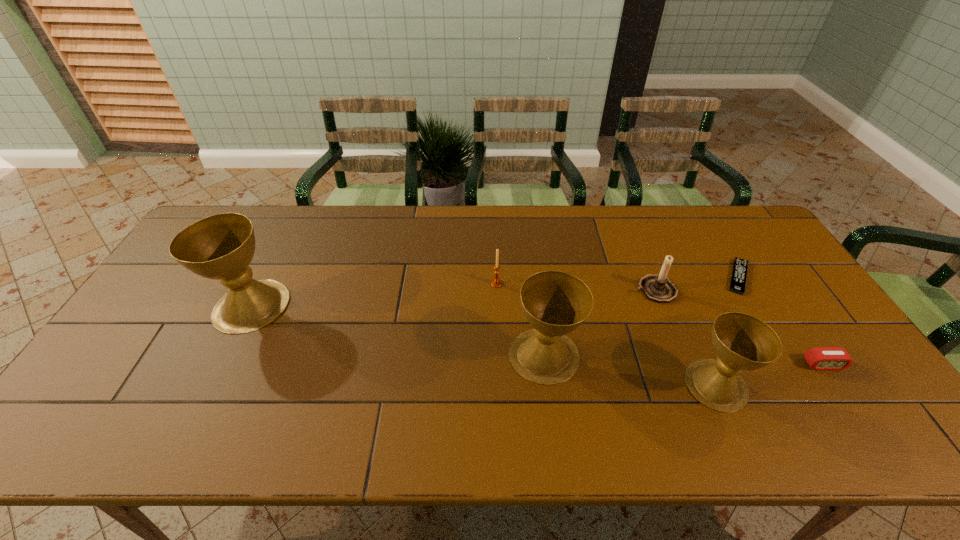
In order to click on vacant space at the left edge of the desktop in this screenshot , I will do `click(195, 298)`.

Image resolution: width=960 pixels, height=540 pixels. Identify the location of free region at the right edge of the desktop. (788, 309).

Locate an element on the screen. vacant space at the far right corner of the desktop is located at coordinates (749, 247).

Locate an element on the screen. The image size is (960, 540). vacant area between the remote control and the alarm clock is located at coordinates (780, 321).

Locate an element on the screen. The width and height of the screenshot is (960, 540). empty space that is in between the right candle_holder and the shortest object is located at coordinates (697, 284).

At what (x,y) coordinates should I click in order to perform the action: click on free space between the third object from left to right and the second object from left to right. Please return your answer as a coordinate pair (x, y). This screenshot has width=960, height=540. Looking at the image, I should click on point(520,320).

At what (x,y) coordinates should I click in order to perform the action: click on vacant area that lies between the shortest chalice and the right candle_holder. Please return your answer as a coordinate pair (x, y). Looking at the image, I should click on (685, 338).

The width and height of the screenshot is (960, 540). I want to click on free space that is in between the second chalice from right to left and the sixth tallest object, so click(684, 360).

Where is `free space between the second shortest chalice and the right candle_holder`? free space between the second shortest chalice and the right candle_holder is located at coordinates (600, 323).

Where is `free space that is in between the third object from left to right and the right candle_holder`? free space that is in between the third object from left to right and the right candle_holder is located at coordinates (600, 323).